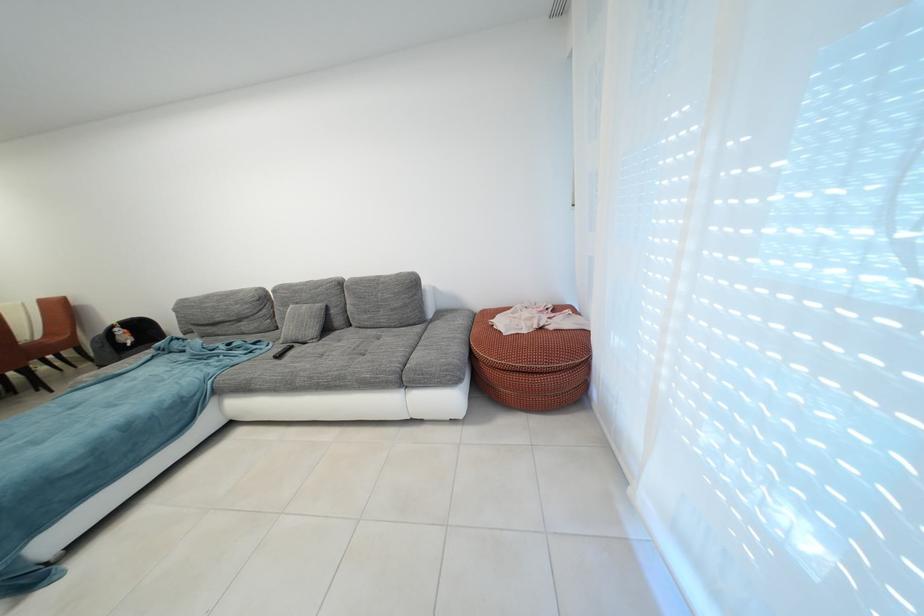
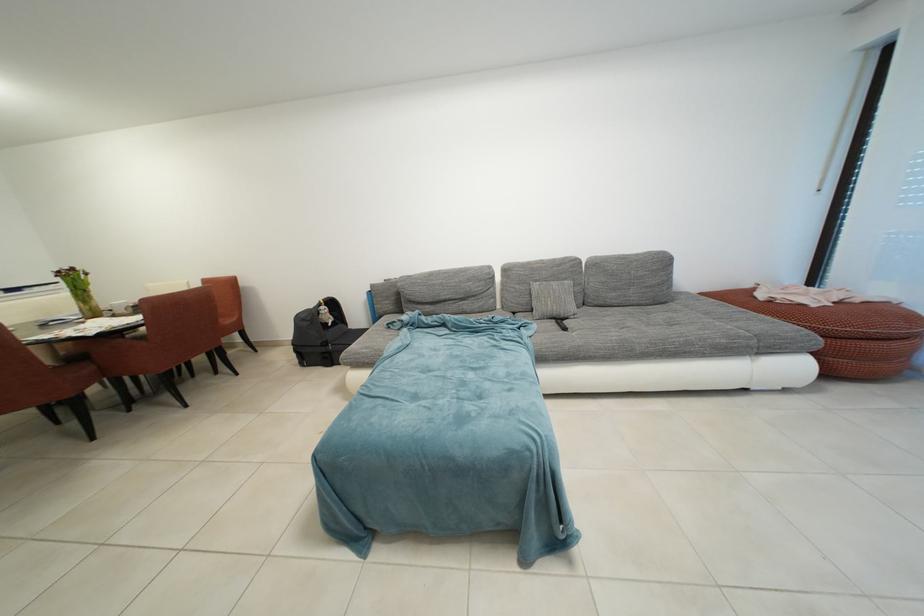
Where in the second image is the point corresponding to [345,310] from the first image?

(588, 289)